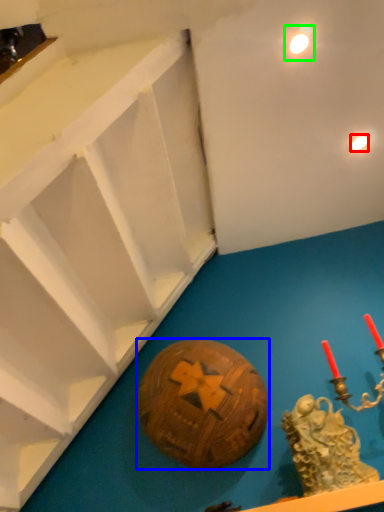
Question: Based on their relative distances, which object is nearer to light (highlighted by a red box)? Choose from ball (highlighted by a blue box) and light (highlighted by a green box).

Choices:
 (A) ball
 (B) light

Answer: (B)